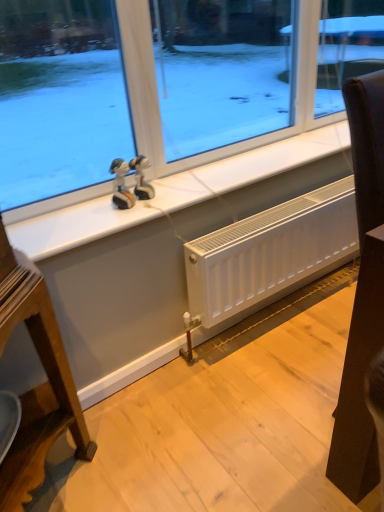
The width and height of the screenshot is (384, 512). In order to click on vacant space behind glossy plastic figurine at upper center, which is counted as the first figurine, starting from the right in this screenshot , I will do 163,183.